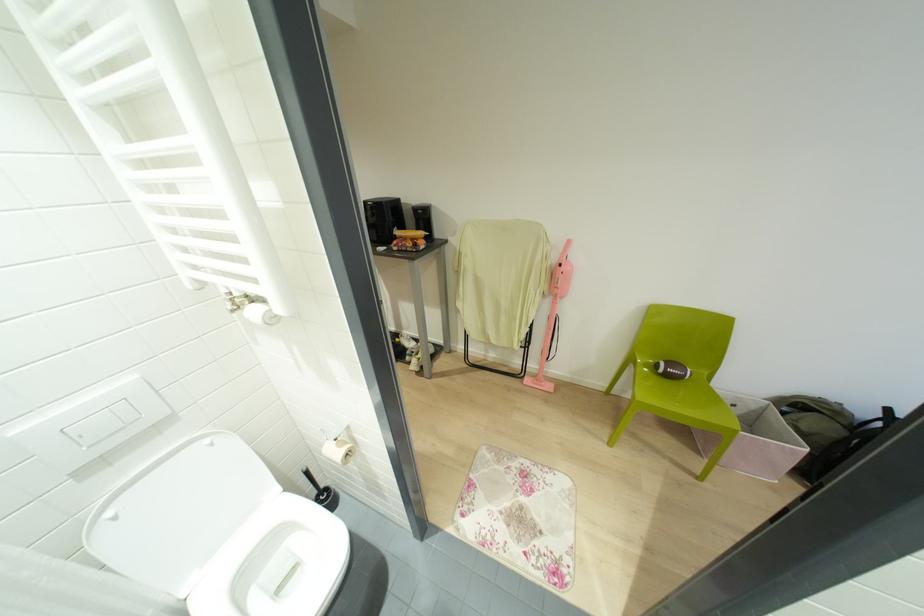
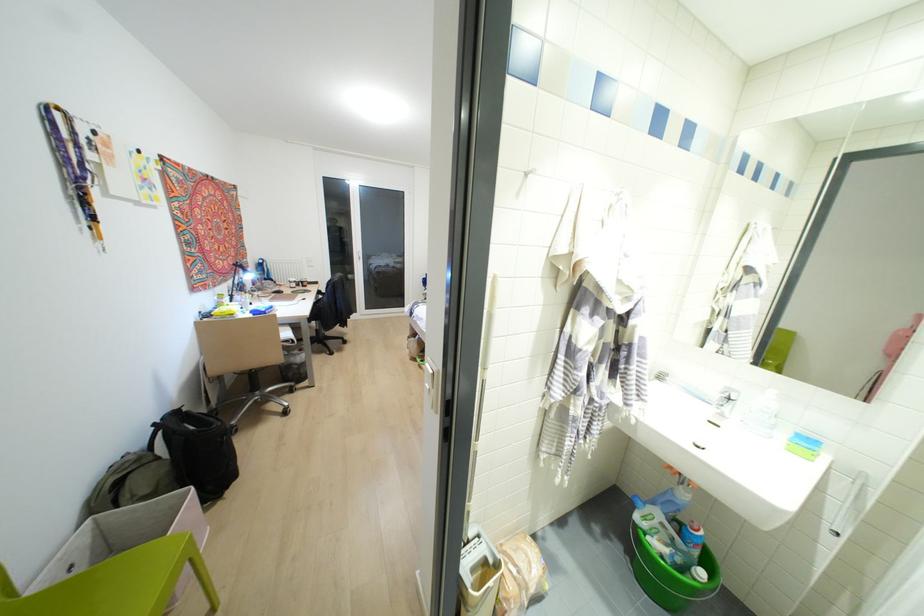
Find the pixel in the second image that matches pixel 889 410 in the first image.

(153, 424)